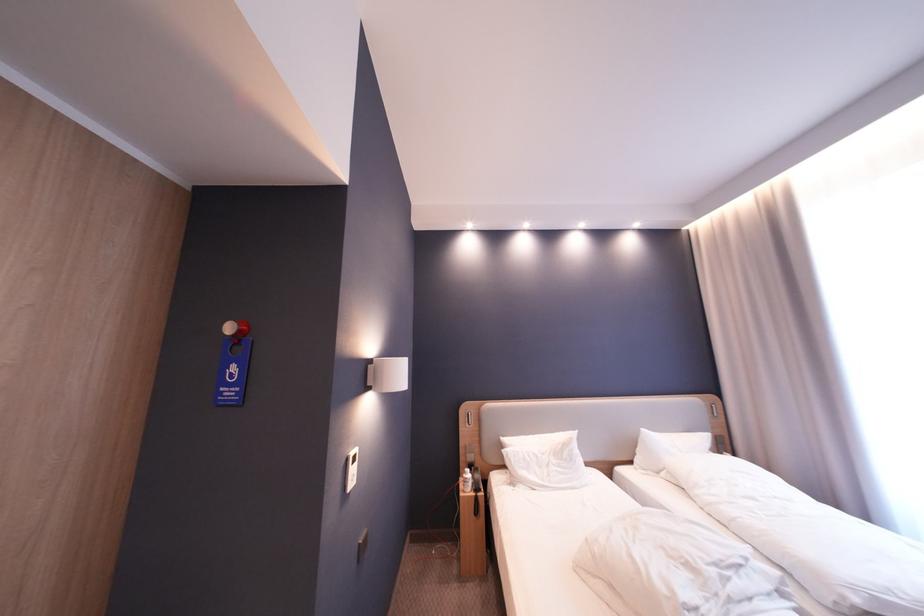
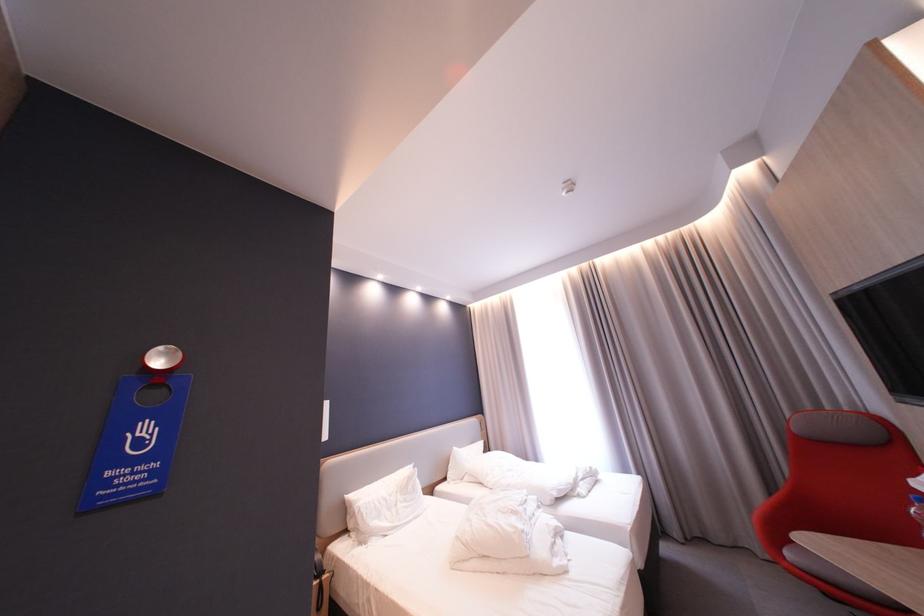
Question: How did the camera likely rotate?

Choices:
 (A) Left
 (B) Right
 (C) Up
 (D) Down

Answer: (B)